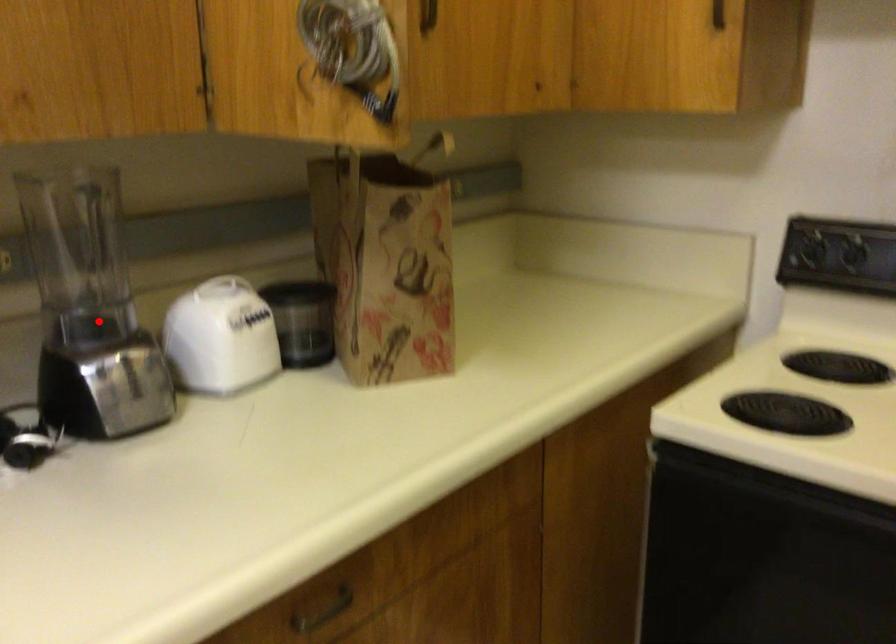
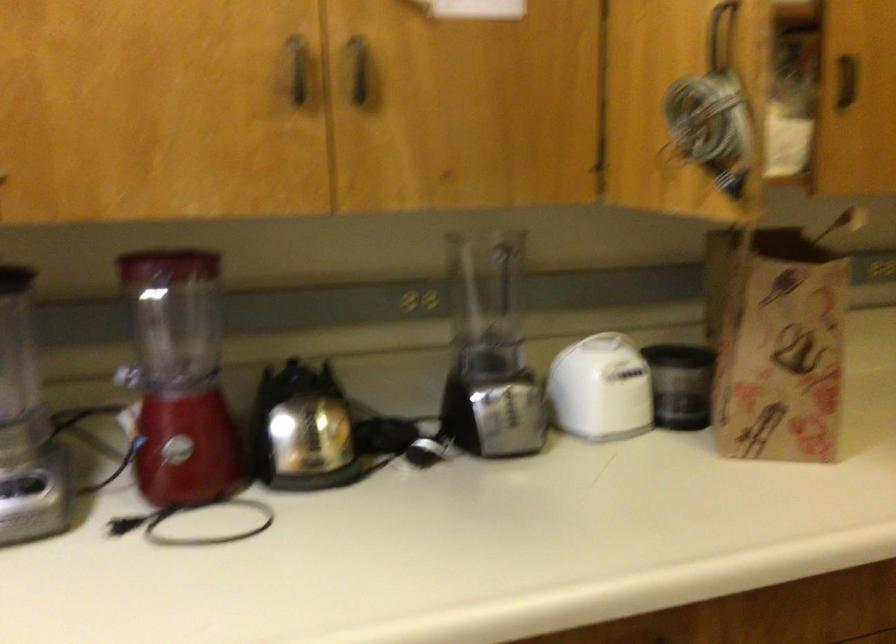
In the second image, find the point that corresponds to the highlighted location in the first image.

(489, 351)